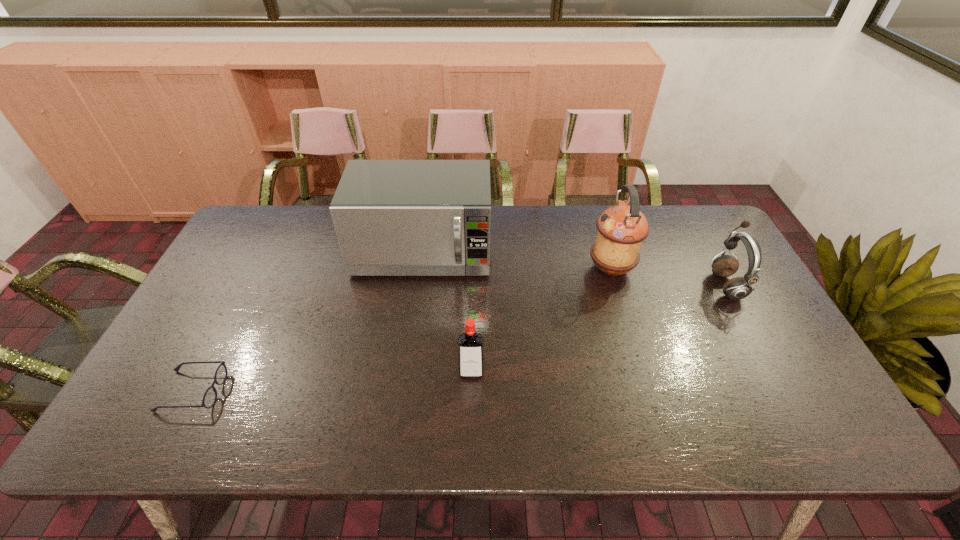
I want to click on vacant space in between the vodka and the spectacles, so click(x=332, y=382).

Find the location of a particular element. This screenshot has width=960, height=540. object that is the second closest to the fourth object from left to right is located at coordinates (392, 217).

Select which object is the closest to the vodka. Please provide its 2D coordinates. Your answer should be formatted as a tuple, i.e. [(x, y)], where the tuple contains the x and y coordinates of a point satisfying the conditions above.

[(392, 217)]

At what (x,y) coordinates should I click in order to perform the action: click on vacant region that satisfies the following two spatial constraints: 1. with the door open on the microwave oven; 2. on the right side of the oil lamp. Please return your answer as a coordinate pair (x, y). Looking at the image, I should click on (420, 268).

The image size is (960, 540). In order to click on vacant space that satisfies the following two spatial constraints: 1. on the front and back of the vodka; 2. on the front-facing side of the spectacles in this screenshot , I will do `click(471, 392)`.

This screenshot has height=540, width=960. Find the location of `free space that satisfies the following two spatial constraints: 1. with the door open on the microwave oven; 2. on the front-facing side of the leftmost object`. free space that satisfies the following two spatial constraints: 1. with the door open on the microwave oven; 2. on the front-facing side of the leftmost object is located at coordinates 404,392.

Locate an element on the screen. This screenshot has height=540, width=960. vacant space that satisfies the following two spatial constraints: 1. with the door open on the microwave oven; 2. on the left side of the oil lamp is located at coordinates (420, 268).

The image size is (960, 540). What are the coordinates of `free space in the image that satisfies the following two spatial constraints: 1. on the front side of the oil lamp; 2. on the front-facing side of the spectacles` in the screenshot? It's located at (648, 392).

Identify the location of vacant space that satisfies the following two spatial constraints: 1. on the front and back of the vodka; 2. on the front-facing side of the spectacles. (471, 392).